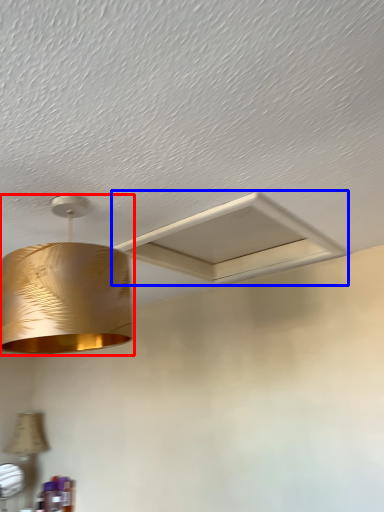
Question: Which object is closer to the camera taking this photo, lamp (highlighted by a red box) or exhaust hood (highlighted by a blue box)?

Choices:
 (A) lamp
 (B) exhaust hood

Answer: (A)